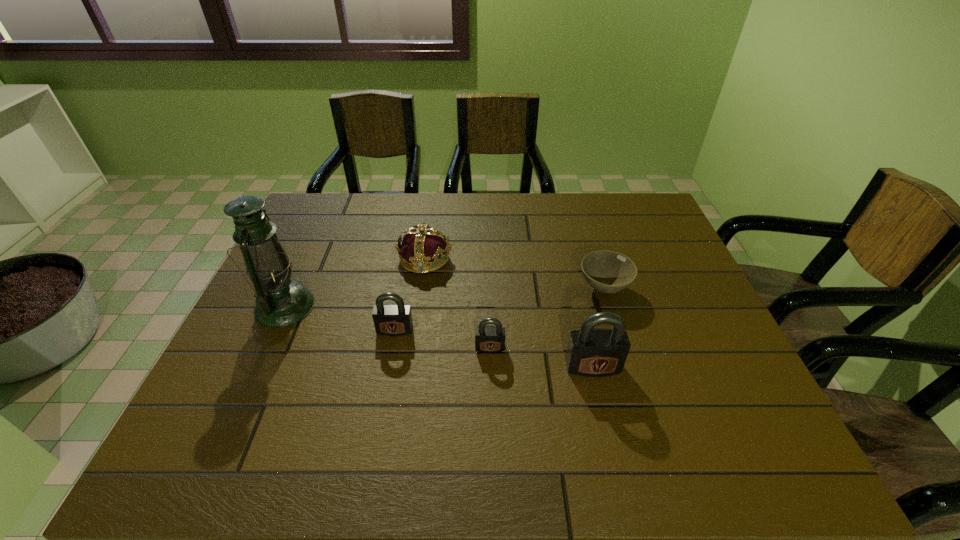
This screenshot has height=540, width=960. Identify the location of free spot between the tallest object and the fifth shortest object. (439, 336).

Where is `free space between the second tallest padlock and the second shortest object`? free space between the second tallest padlock and the second shortest object is located at coordinates (443, 339).

The width and height of the screenshot is (960, 540). What are the coordinates of `free space that is in between the second shortest padlock and the second nearest object` in the screenshot? It's located at (443, 339).

In order to click on object that is the fifth closest one to the nearest object in this screenshot , I will do `click(280, 301)`.

Image resolution: width=960 pixels, height=540 pixels. Identify the location of the fourth closest object to the bowl. (389, 319).

Choose which padlock is the nearest neighbor to the oil lamp. Please provide its 2D coordinates. Your answer should be formatted as a tuple, i.e. [(x, y)], where the tuple contains the x and y coordinates of a point satisfying the conditions above.

[(389, 319)]

This screenshot has height=540, width=960. Find the location of `padlock that can be found as the second closest to the second tallest object`. padlock that can be found as the second closest to the second tallest object is located at coordinates (389, 319).